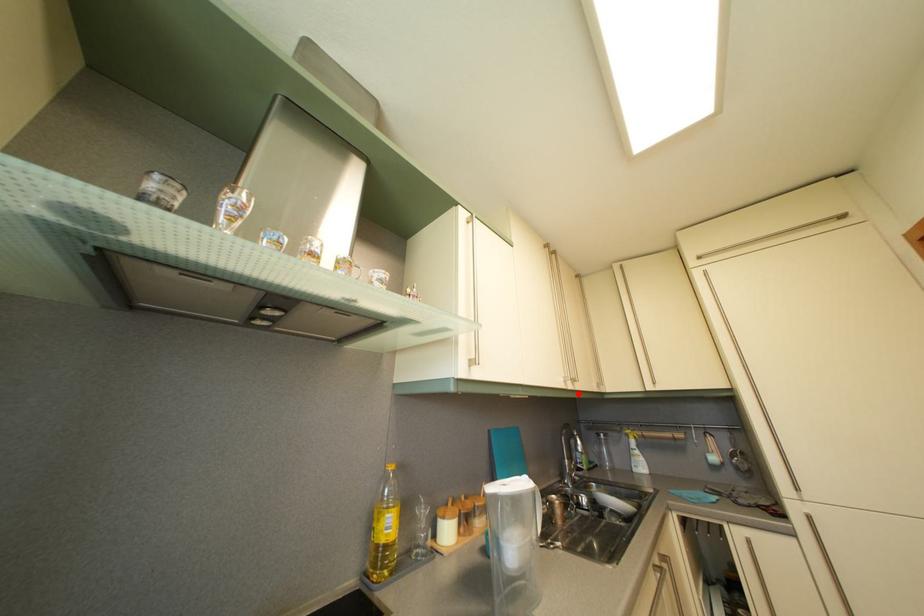
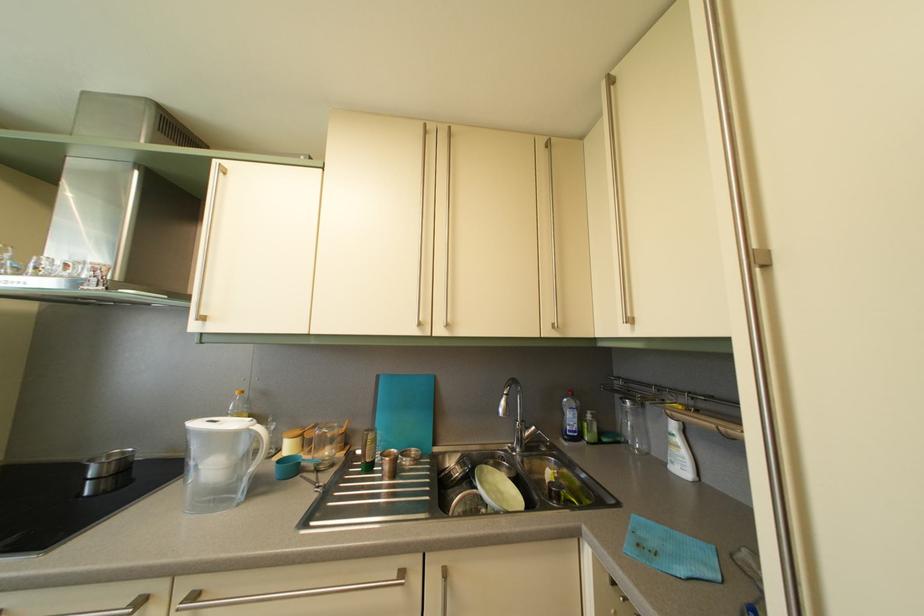
Locate, in the second image, the point that corresponds to the highlighted location in the first image.

(447, 339)